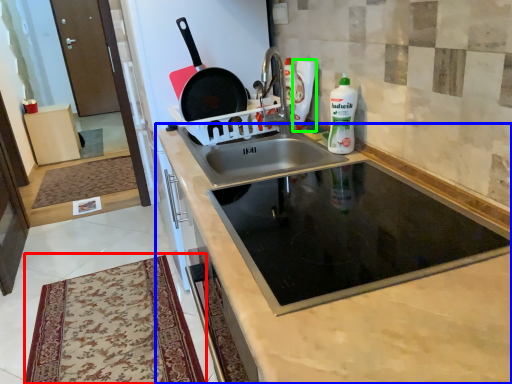
Question: Which object is positioned closest to mat (highlighted by a red box)? Select from cabinetry (highlighted by a blue box) and cleaning product (highlighted by a green box).

Choices:
 (A) cabinetry
 (B) cleaning product

Answer: (A)